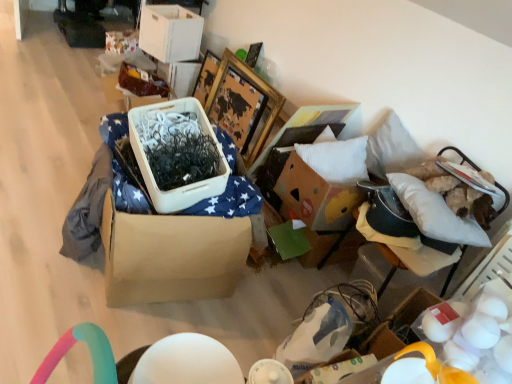
Question: Is brown cardboard box at center not close to wooden picture frame at upper center?

Choices:
 (A) no
 (B) yes

Answer: (B)

Question: From the image's perspective, would you say brown cardboard box at center is shown under wooden picture frame at upper center?

Choices:
 (A) yes
 (B) no

Answer: (A)

Question: Is brown cardboard box at center behind wooden picture frame at upper center?

Choices:
 (A) no
 (B) yes

Answer: (A)

Question: Does brown cardboard box at center lie in front of wooden picture frame at upper center?

Choices:
 (A) no
 (B) yes

Answer: (B)

Question: Is brown cardboard box at center thinner than wooden picture frame at upper center?

Choices:
 (A) no
 (B) yes

Answer: (A)

Question: From a real-world perspective, relative to wooden picture frame at upper center, is white fabric cushion at right vertically above or below?

Choices:
 (A) above
 (B) below

Answer: (A)

Question: Is white fabric cushion at right spatially inside wooden picture frame at upper center, or outside of it?

Choices:
 (A) outside
 (B) inside

Answer: (A)

Question: Is point (399, 261) closer or farther from the camera than point (227, 69)?

Choices:
 (A) farther
 (B) closer

Answer: (B)

Question: From the image's perspective, is white fabric cushion at right above or below wooden picture frame at upper center?

Choices:
 (A) below
 (B) above

Answer: (A)

Question: Visually, is white fabric cushion at right positioned to the left or to the right of white soft pillow at upper right?

Choices:
 (A) right
 (B) left

Answer: (A)

Question: Considering the positions of white fabric cushion at right and white soft pillow at upper right in the image, is white fabric cushion at right wider or thinner than white soft pillow at upper right?

Choices:
 (A) wide
 (B) thin

Answer: (A)

Question: Do you think white fabric cushion at right is within white soft pillow at upper right, or outside of it?

Choices:
 (A) outside
 (B) inside

Answer: (A)

Question: In terms of height, does white fabric cushion at right look taller or shorter compared to white soft pillow at upper right?

Choices:
 (A) tall
 (B) short

Answer: (B)

Question: From the image's perspective, is wooden picture frame at upper center above or below white cardboard storage box at upper center, arranged as the 1th storage box when viewed from the top?

Choices:
 (A) below
 (B) above

Answer: (A)

Question: Is wooden picture frame at upper center bigger or smaller than white cardboard storage box at upper center, which ranks as the second storage box in bottom-to-top order?

Choices:
 (A) small
 (B) big

Answer: (B)